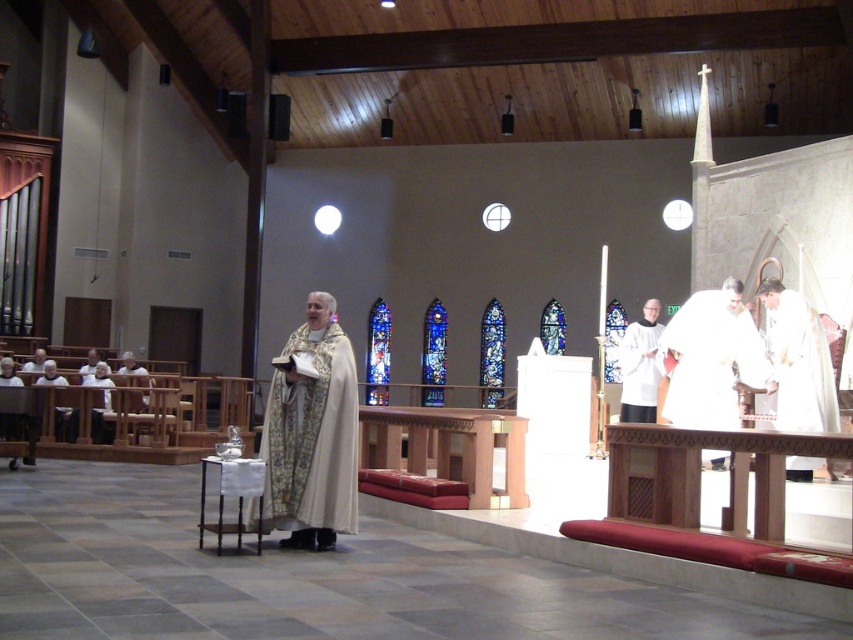
From the picture: You are standing in the church and want to take a photo of both point (469, 442) and point (817, 323). Which point will appear larger in your photo?

Point (469, 442) is closer to the camera than point (817, 323), so it will appear larger in the photo.

You are an event planner setting up for a wedding ceremony in this church. You need to place a bouquet on the wooden altar at center. However, there is a white cloth at right currently covering it. What should you do first to access the altar?

The wooden altar at center is positioned under the white cloth at right, so you should remove or move the white cloth at right to access the wooden altar at center.